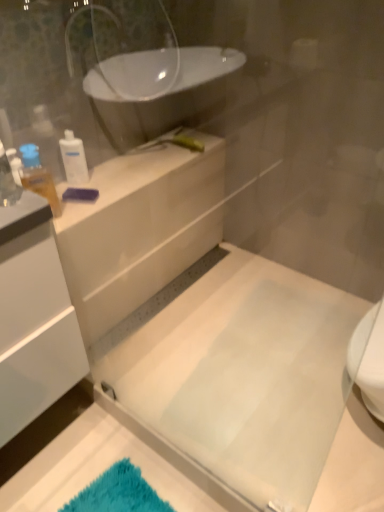
The height and width of the screenshot is (512, 384). In order to click on unoccupied region to the right of white plastic bottle at upper left, positioned as the 2th toiletry in front-to-back order in this screenshot , I will do `click(125, 176)`.